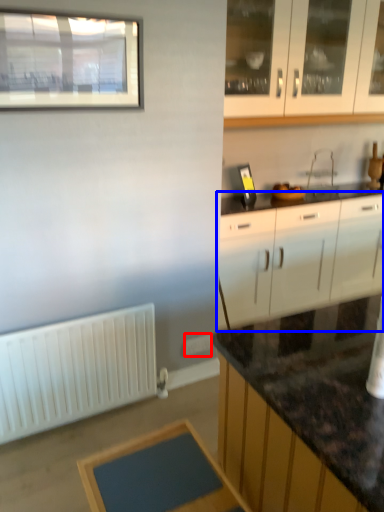
Question: Which object appears farthest to the camera in this image, electric outlet (highlighted by a red box) or cabinetry (highlighted by a blue box)?

Choices:
 (A) electric outlet
 (B) cabinetry

Answer: (B)